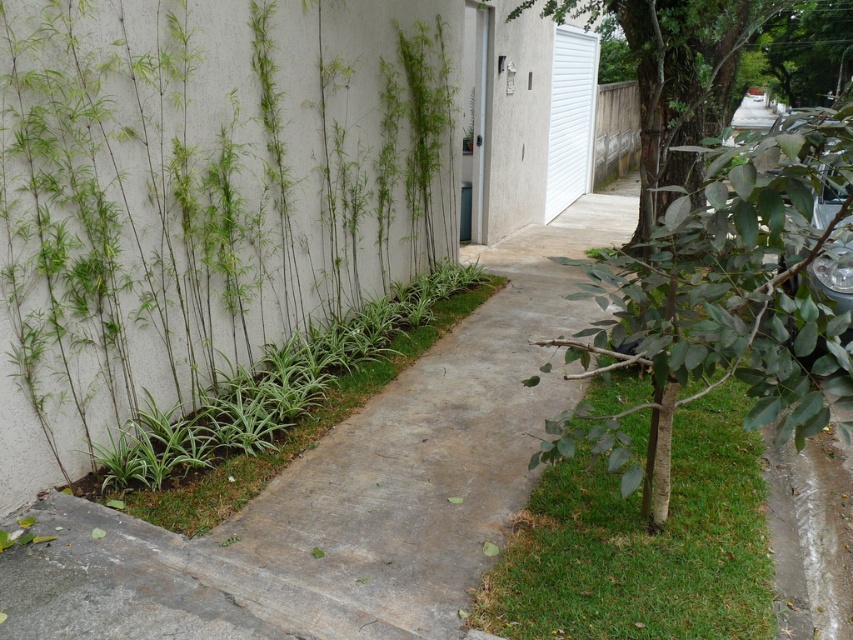
You are a gardener planning to trim the green bamboo at left and the green grass at center. Which of the two plants requires a taller ladder to reach the top?

The green bamboo at left requires a taller ladder because it has a larger size compared to the green grass at center.